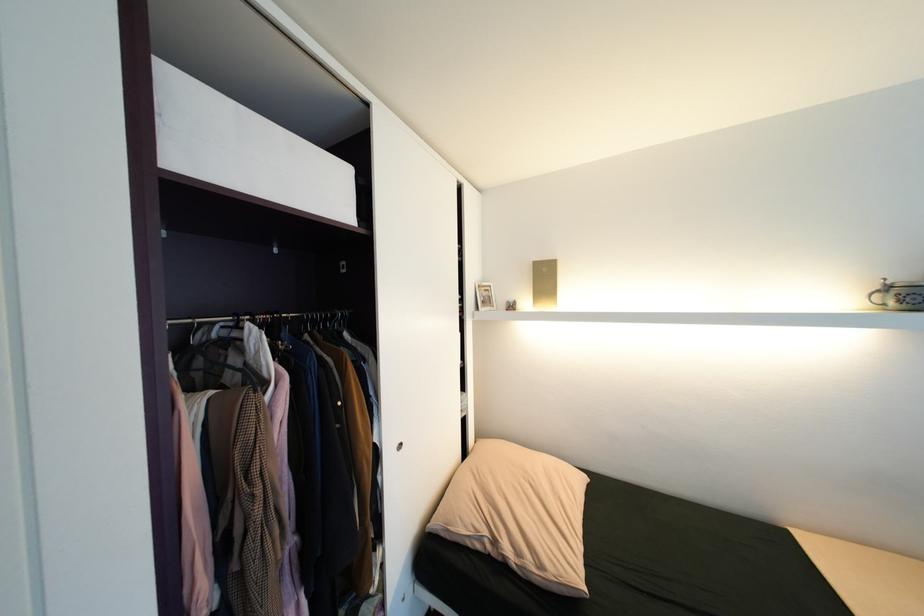
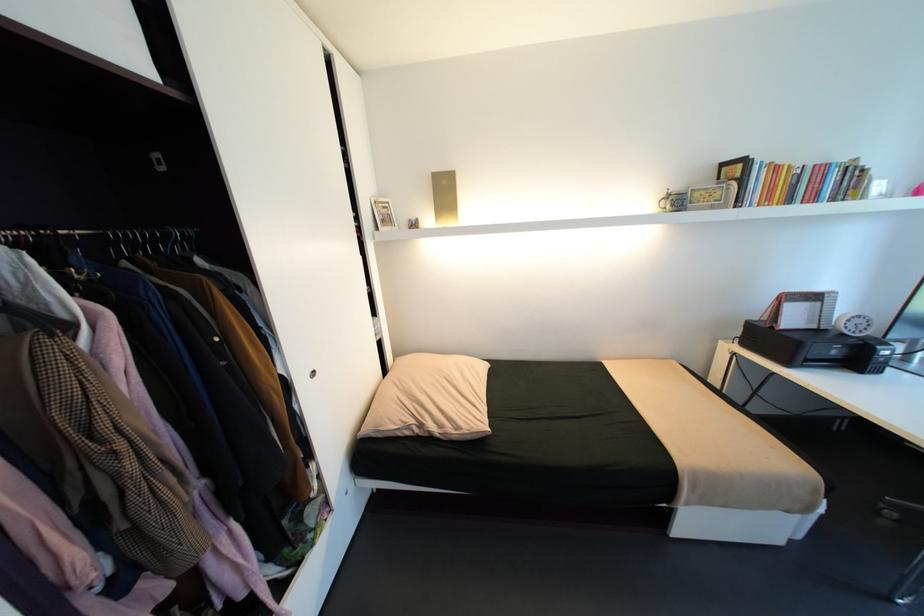
In the second image, find the point that corresponds to point (485, 546) in the first image.

(415, 432)